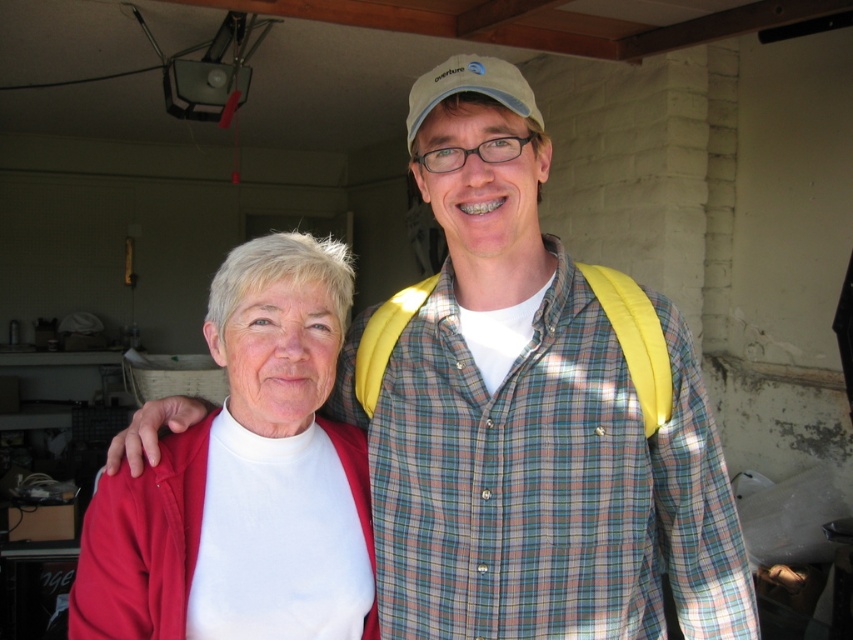
You are standing in a garage and see two points marked in the image. The first point is at coordinates point (693, 486) and the second is at point (238, 328). Which point is closer to you?

Point (693, 486) is closer to you because it is further to the viewer than point (238, 328).

You are standing in the garage and need to locate the yellow fabric backpack at center. According to the coordinates provided, where exactly is it positioned?

The yellow fabric backpack at center is located at the coordinates point (x=531, y=417).

You are a photographer setting up a shot in a garage. You have a camera that can focus on objects within 10 inches. You see the yellow fabric backpack at center and the matte white turtleneck at center. Can your camera focus on both objects at the same time?

The distance between the yellow fabric backpack at center and the matte white turtleneck at center is 8.34 inches. Since your camera can focus within 10 inches, both objects are within the focus range and can be captured clearly in the same shot.